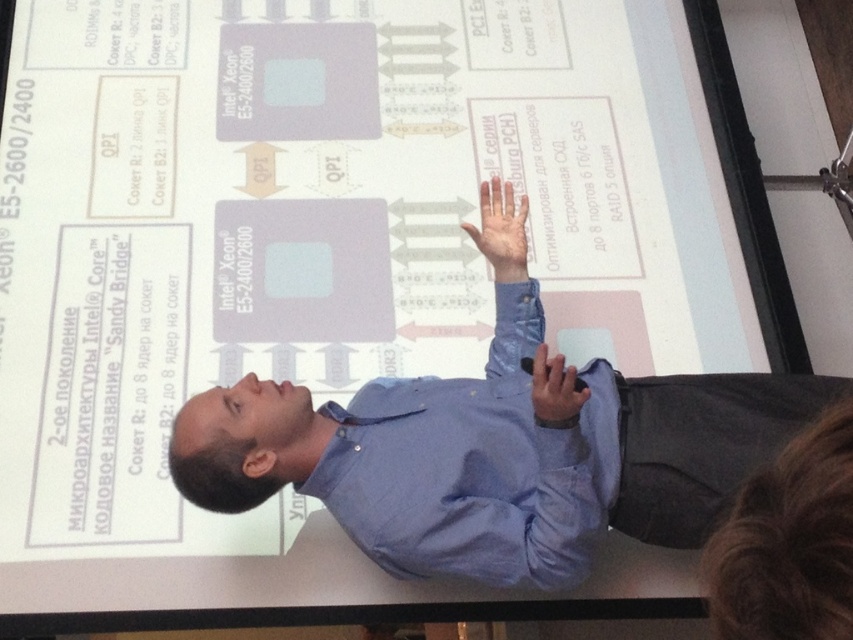
The person in the scene is giving a presentation. They are gesturing with their right hand raised. Where is the point marked as point [502,230] in the image?

The point [502,230] marks light brown skin at upper center.

You are an attendee at a tech conference and need to take a photo of the presenter. The presenter is wearing a blue shirt at center. To ensure the photo includes both the presenter and the projection screen behind them, where should you position yourself relative to the presenter?

The blue shirt at center is positioned at point [496,456], so to capture both the presenter and the projection screen in your photo, you should position yourself slightly to the side or behind the presenter to ensure both are in frame.